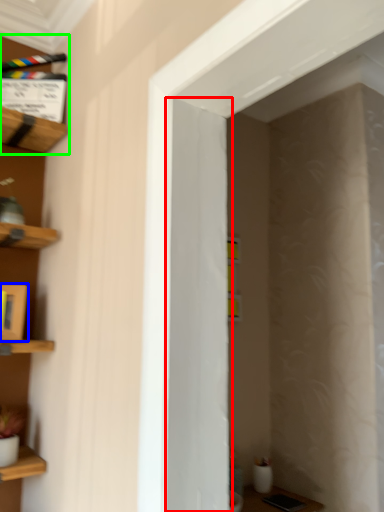
Question: Considering the real-world distances, which object is closest to door (highlighted by a red box)? cabinet (highlighted by a blue box) or shelf (highlighted by a green box).

Choices:
 (A) cabinet
 (B) shelf

Answer: (A)